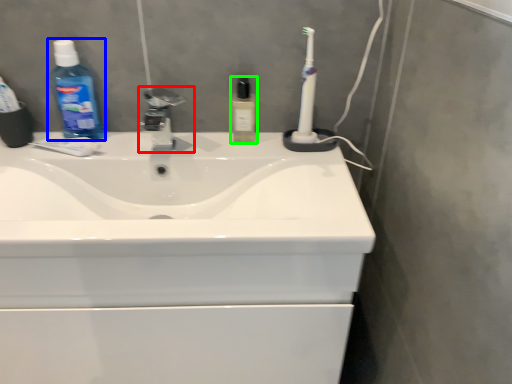
Question: Based on their relative distances, which object is farther from tap (highlighted by a red box)? Choose from cleaning product (highlighted by a blue box) and toiletry (highlighted by a green box).

Choices:
 (A) cleaning product
 (B) toiletry

Answer: (B)